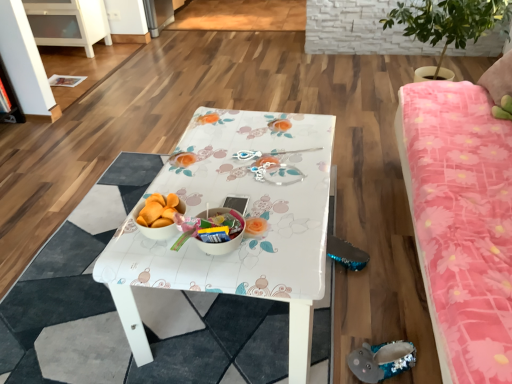
This screenshot has height=384, width=512. Find the location of `vacant space to the right of white glossy bowl at center`. vacant space to the right of white glossy bowl at center is located at coordinates (285, 236).